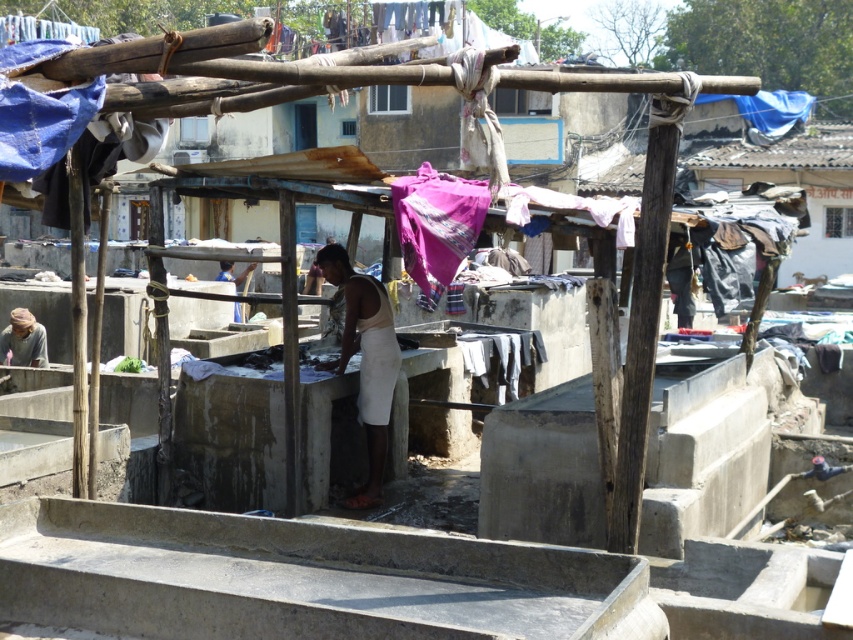
Question: Can you confirm if white cotton cloth at center is thinner than white cotton dress at lower center?

Choices:
 (A) no
 (B) yes

Answer: (A)

Question: Is white cotton cloth at center wider than white cotton dress at lower center?

Choices:
 (A) yes
 (B) no

Answer: (A)

Question: Does white cotton cloth at center have a smaller size compared to white cotton dress at lower center?

Choices:
 (A) yes
 (B) no

Answer: (B)

Question: Among these objects, which one is farthest from the camera?

Choices:
 (A) white cotton cloth at center
 (B) white cotton dress at lower center

Answer: (B)